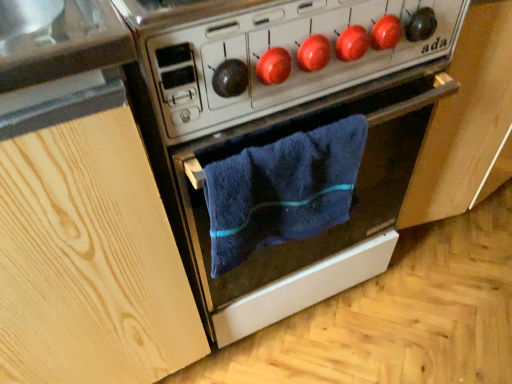
Question: Considering the relative positions of light wood cabinet at left and metallic silver oven at center in the image provided, is light wood cabinet at left behind metallic silver oven at center?

Choices:
 (A) no
 (B) yes

Answer: (A)

Question: Could you tell me if light wood cabinet at left is turned towards metallic silver oven at center?

Choices:
 (A) no
 (B) yes

Answer: (A)

Question: Is light wood cabinet at left to the right of metallic silver oven at center from the viewer's perspective?

Choices:
 (A) yes
 (B) no

Answer: (B)

Question: Could metallic silver oven at center be considered to be inside light wood cabinet at left?

Choices:
 (A) no
 (B) yes

Answer: (A)

Question: Is light wood cabinet at left thinner than metallic silver oven at center?

Choices:
 (A) yes
 (B) no

Answer: (A)

Question: In terms of height, does blue soft towel at center look taller or shorter compared to metallic stove at center?

Choices:
 (A) tall
 (B) short

Answer: (A)

Question: Relative to metallic stove at center, is blue soft towel at center in front or behind?

Choices:
 (A) behind
 (B) front

Answer: (A)

Question: From the image's perspective, is blue soft towel at center above or below metallic stove at center?

Choices:
 (A) below
 (B) above

Answer: (A)

Question: In terms of size, does blue soft towel at center appear bigger or smaller than metallic stove at center?

Choices:
 (A) small
 (B) big

Answer: (A)

Question: Considering the positions of blue soft towel at center and light wood cabinet at left in the image, is blue soft towel at center bigger or smaller than light wood cabinet at left?

Choices:
 (A) big
 (B) small

Answer: (B)

Question: Considering the positions of point (332, 152) and point (15, 183), is point (332, 152) closer or farther from the camera than point (15, 183)?

Choices:
 (A) closer
 (B) farther

Answer: (B)

Question: In the image, is blue soft towel at center positioned in front of or behind light wood cabinet at left?

Choices:
 (A) behind
 (B) front

Answer: (A)

Question: From a real-world perspective, is blue soft towel at center physically located above or below light wood cabinet at left?

Choices:
 (A) below
 (B) above

Answer: (B)

Question: From the image's perspective, is metallic silver oven at center positioned above or below blue soft towel at center?

Choices:
 (A) below
 (B) above

Answer: (B)

Question: In terms of size, does metallic silver oven at center appear bigger or smaller than blue soft towel at center?

Choices:
 (A) big
 (B) small

Answer: (A)